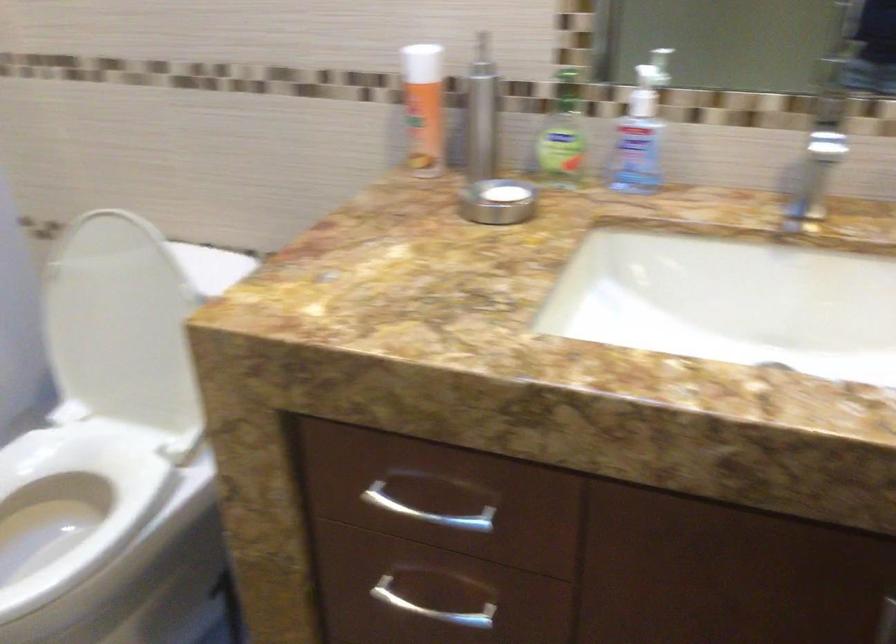
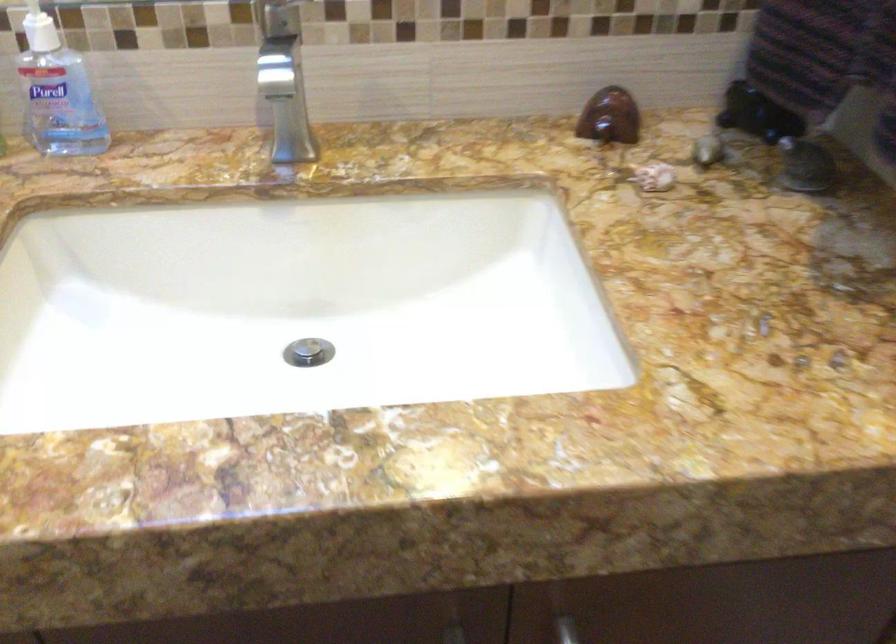
The images are taken continuously from a first-person perspective. In which direction are you moving?

The cameraman moved toward right, forward.